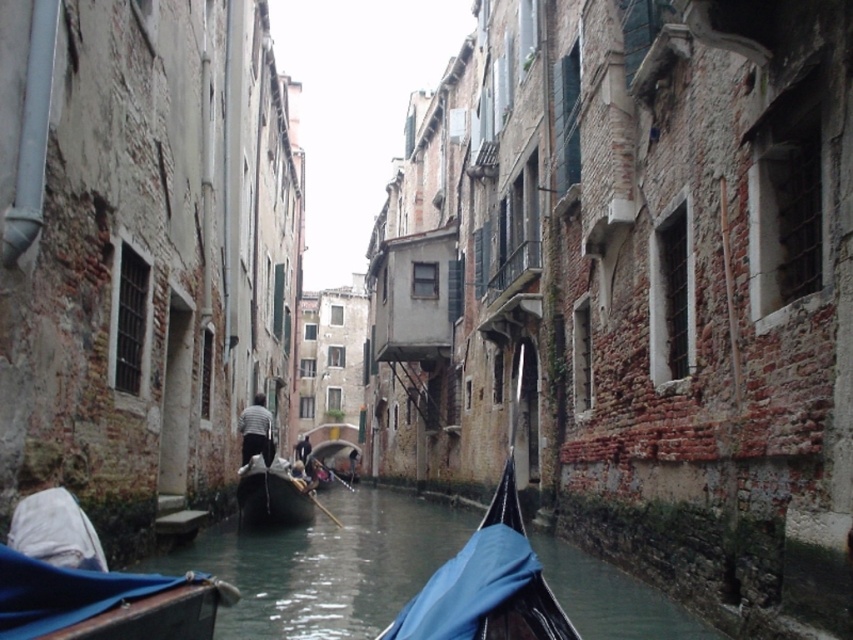
Does white cloth at lower left have a greater width compared to wooden gondola at center?

Incorrect, white cloth at lower left's width does not surpass wooden gondola at center's.

Is point (91, 564) in front of point (302, 499)?

Yes, point (91, 564) is closer to viewer.

Who is more distant from viewer, (18,509) or (299,522)?

Positioned behind is point (299,522).

Identify the location of white cloth at lower left. (55, 531).

Is point (289, 548) behind point (263, 420)?

No.

This screenshot has height=640, width=853. What do you see at coordinates (326, 564) in the screenshot?
I see `blue fabric-covered boat at center` at bounding box center [326, 564].

The height and width of the screenshot is (640, 853). I want to click on blue fabric-covered boat at center, so click(326, 564).

Measure the distance between point (12, 557) and camera.

35.81 feet

Which is more to the left, blue fabric boat at lower center or striped fabric shirt at center?

From the viewer's perspective, striped fabric shirt at center appears more on the left side.

Which is in front, point (67, 620) or point (262, 394)?

Point (67, 620) is in front.

This screenshot has height=640, width=853. I want to click on blue fabric boat at lower center, so click(x=67, y=593).